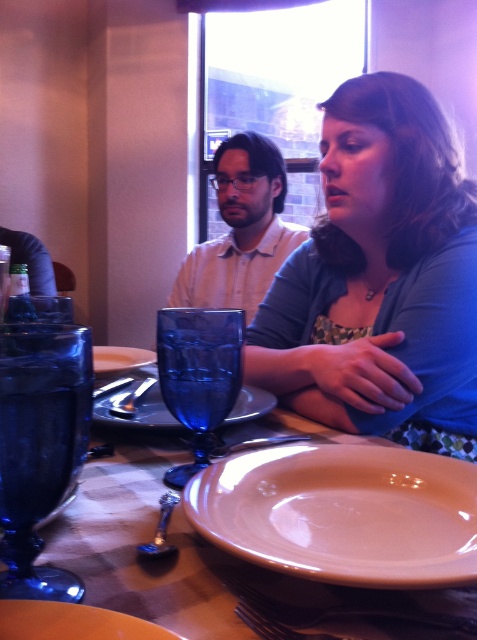
You are a customer at this restaurant and want to use the spoon closest to you. Which spoon should you choose between the satin silver spoon at lower center and the brushed metal spoon at center?

The satin silver spoon at lower center is positioned on the right side of the brushed metal spoon at center, so the brushed metal spoon at center is closer to you. You should choose the brushed metal spoon at center.

You are a waiter in a restaurant and need to place a new menu on the table. The menu is 1 inch thick. The space between the matte orange plate at lower center and the brushed metal knife at upper left is 2 inches. Can the menu fit vertically between them?

The matte orange plate at lower center has a lesser height compared to the brushed metal knife at upper left. Since the menu is 1 inch thick and the space between them is 2 inches, the menu can fit vertically between the matte orange plate at lower center and the brushed metal knife at upper left as there is enough space.

You are a server at the restaurant and need to place both the satin silver spoon at lower center and the brushed metal spoon at center on a 10 cm wide plate. Can you fit both spoons side by side on the plate without overlapping?

The satin silver spoon at lower center is narrower than the brushed metal spoon at center. Since the total width of both spoons combined would be less than 10 cm, they can fit side by side on the plate without overlapping.